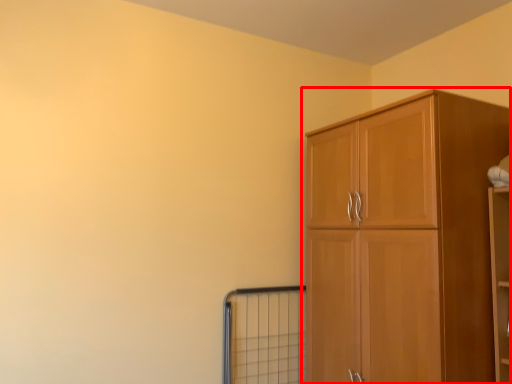
Question: Where is cupboard (annotated by the red box) located in relation to window in the image?

Choices:
 (A) right
 (B) left

Answer: (A)